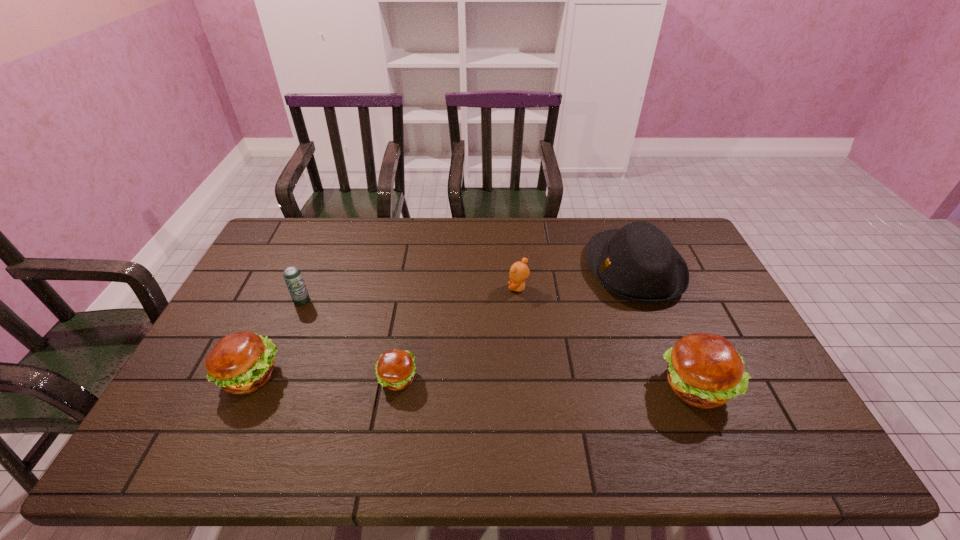
Where is `vacant space located on the right of the beer can`? This screenshot has height=540, width=960. vacant space located on the right of the beer can is located at coordinates (391, 301).

This screenshot has width=960, height=540. What are the coordinates of `vacant space located on the front-facing side of the fedora` in the screenshot? It's located at (497, 269).

The image size is (960, 540). I want to click on free space located 0.300m on the front-facing side of the fedora, so click(497, 269).

In order to click on free space located on the front-facing side of the fedora in this screenshot , I will do 489,269.

Identify the location of free space located 0.230m on the face of the third object from right to left. The width and height of the screenshot is (960, 540). (436, 288).

Locate an element on the screen. Image resolution: width=960 pixels, height=540 pixels. free location located on the face of the third object from right to left is located at coordinates (418, 288).

This screenshot has width=960, height=540. Identify the location of vacant space located on the face of the third object from right to left. (470, 288).

At what (x,y) coordinates should I click in order to perform the action: click on object that is at the far edge. Please return your answer as a coordinate pair (x, y). Looking at the image, I should click on (637, 263).

Where is `object at the left edge`? The width and height of the screenshot is (960, 540). object at the left edge is located at coordinates (240, 363).

Where is `hamburger positioned at the right edge`? hamburger positioned at the right edge is located at coordinates 704,370.